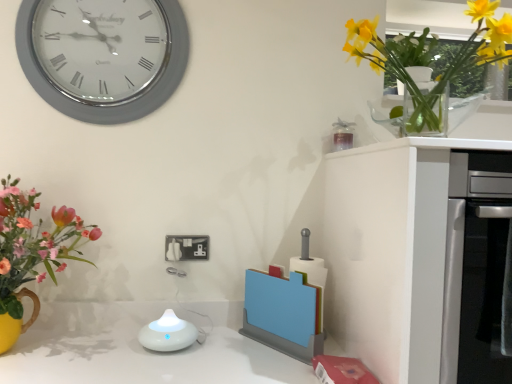
Question: Should I look upward or downward to see silver metallic clock at upper left?

Choices:
 (A) up
 (B) down

Answer: (A)

Question: Is white glossy diffuser at center at the back of white matte cabinet at right?

Choices:
 (A) yes
 (B) no

Answer: (B)

Question: Is white matte cabinet at right aimed at white glossy diffuser at center?

Choices:
 (A) no
 (B) yes

Answer: (A)

Question: Is white glossy diffuser at center a part of white matte cabinet at right?

Choices:
 (A) yes
 (B) no

Answer: (B)

Question: Does white matte cabinet at right have a larger size compared to white glossy diffuser at center?

Choices:
 (A) yes
 (B) no

Answer: (A)

Question: Can you confirm if white matte cabinet at right is smaller than white glossy diffuser at center?

Choices:
 (A) yes
 (B) no

Answer: (B)

Question: Considering the relative sizes of white matte cabinet at right and white glossy diffuser at center in the image provided, is white matte cabinet at right taller than white glossy diffuser at center?

Choices:
 (A) no
 (B) yes

Answer: (B)

Question: Can you confirm if yellow glass vase at upper right is smaller than white matte cabinet at right?

Choices:
 (A) yes
 (B) no

Answer: (A)

Question: Is yellow glass vase at upper right turned away from white matte cabinet at right?

Choices:
 (A) yes
 (B) no

Answer: (B)

Question: Is the position of yellow glass vase at upper right less distant than that of white matte cabinet at right?

Choices:
 (A) yes
 (B) no

Answer: (A)

Question: Is yellow glass vase at upper right not within white matte cabinet at right?

Choices:
 (A) no
 (B) yes

Answer: (B)

Question: From the image's perspective, is yellow glass vase at upper right below white matte cabinet at right?

Choices:
 (A) yes
 (B) no

Answer: (B)

Question: Can you confirm if yellow glass vase at upper right is taller than white matte cabinet at right?

Choices:
 (A) no
 (B) yes

Answer: (A)

Question: Is white matte cabinet at right positioned far away from yellow glass vase at upper right?

Choices:
 (A) yes
 (B) no

Answer: (B)